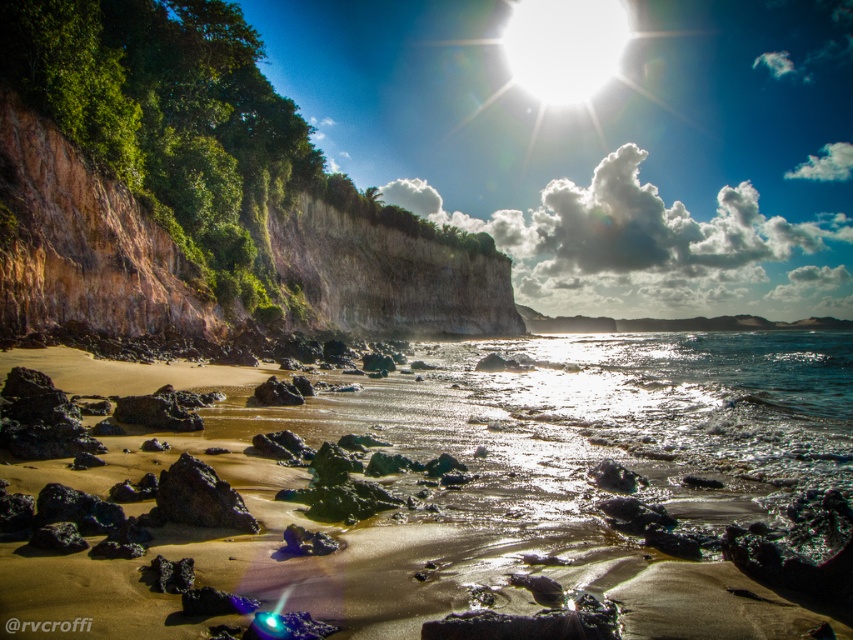
Question: In this image, where is rustic stone cliff at left located relative to rough volcanic rock at center?

Choices:
 (A) above
 (B) below

Answer: (A)

Question: Is sandy beach at center bigger than rustic stone cliff at left?

Choices:
 (A) yes
 (B) no

Answer: (B)

Question: Does sandy beach at center have a larger size compared to rough volcanic rock at center?

Choices:
 (A) no
 (B) yes

Answer: (B)

Question: Which point is closer to the camera?

Choices:
 (A) (474, 310)
 (B) (245, 499)

Answer: (B)

Question: Which is nearer to the rough volcanic rock at center?

Choices:
 (A) rustic stone cliff at left
 (B) sandy beach at center

Answer: (B)

Question: Which object is closer to the camera taking this photo?

Choices:
 (A) sandy beach at center
 (B) rustic stone cliff at left
 (C) rough volcanic rock at center

Answer: (A)